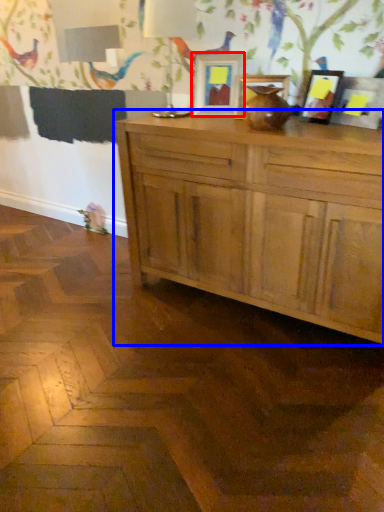
Question: Which of the following is the farthest to the observer, picture frame (highlighted by a red box) or cabinetry (highlighted by a blue box)?

Choices:
 (A) picture frame
 (B) cabinetry

Answer: (A)